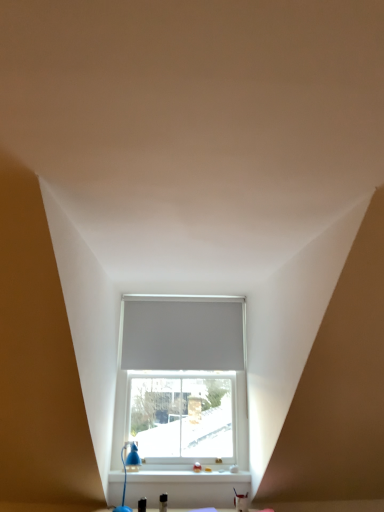
What do you see at coordinates (182, 335) in the screenshot? I see `white matte blind at center` at bounding box center [182, 335].

What do you see at coordinates (188, 477) in the screenshot?
I see `white plastic window sill at lower center` at bounding box center [188, 477].

The image size is (384, 512). I want to click on white plastic window sill at lower center, so pos(188,477).

Where is `blue plastic table lamp at lower left`? The height and width of the screenshot is (512, 384). blue plastic table lamp at lower left is located at coordinates (126, 470).

Find the location of a particular element. This screenshot has height=512, width=384. white matte window at center is located at coordinates (174, 364).

At what (x,y) coordinates should I click in order to perform the action: click on white matte blind at center. Please return your answer as a coordinate pair (x, y). This screenshot has width=384, height=512. Looking at the image, I should click on (182, 335).

From a real-world perspective, between white matte blind at center and white matte window at center, who is vertically lower?

white matte window at center, from a real-world perspective.

Between white matte blind at center and white matte window at center, which one has more height?

white matte window at center.

What's the angular difference between white matte blind at center and white matte window at center's facing directions?

The angular difference between white matte blind at center and white matte window at center is 0.00343 degrees.

Does white matte blind at center appear on the right side of white matte window at center?

Yes, white matte blind at center is to the right of white matte window at center.

From the picture: How different are the orientations of blue plastic table lamp at lower left and white plastic window sill at lower center in degrees?

blue plastic table lamp at lower left and white plastic window sill at lower center are facing 0.00545 degrees away from each other.

Is point (129, 465) closer to viewer compared to point (161, 482)?

No, it is behind (161, 482).

Locate an element on the screen. table lamp above the white plastic window sill at lower center (from a real-world perspective) is located at coordinates (126, 470).

Considering the sizes of objects blue plastic table lamp at lower left and white plastic window sill at lower center in the image provided, who is smaller, blue plastic table lamp at lower left or white plastic window sill at lower center?

Smaller between the two is blue plastic table lamp at lower left.

Is white plastic window sill at lower center inside or outside of white matte blind at center?

white plastic window sill at lower center is spatially situated outside white matte blind at center.

You are a GUI agent. You are given a task and a screenshot of the screen. Output one action in this format:
    pyautogui.click(x=<x>, y=<y>)
    Task: Click on the window sill in front of the white matte blind at center
    This screenshot has height=512, width=384.
    Given the screenshot: What is the action you would take?
    pyautogui.click(x=188, y=477)

From a real-world perspective, who is located higher, white plastic window sill at lower center or white matte blind at center?

In real-world perspective, white matte blind at center is above.

Consider the image. Considering the relative sizes of white plastic window sill at lower center and white matte blind at center in the image provided, is white plastic window sill at lower center bigger than white matte blind at center?

No, white plastic window sill at lower center is not bigger than white matte blind at center.

Is blue plastic table lamp at lower left bigger or smaller than white matte blind at center?

Clearly, blue plastic table lamp at lower left is smaller in size than white matte blind at center.

From the image's perspective, is blue plastic table lamp at lower left above white matte blind at center?

No.

Would you say white matte blind at center is part of blue plastic table lamp at lower left's contents?

No, white matte blind at center is not inside blue plastic table lamp at lower left.

Considering the points (122, 456) and (203, 343), which point is in front, point (122, 456) or point (203, 343)?

Point (122, 456)

Does white matte blind at center have a greater height compared to white plastic window sill at lower center?

Correct, white matte blind at center is much taller as white plastic window sill at lower center.

Where is `window sill directly beneath the white matte blind at center (from a real-world perspective)`? The width and height of the screenshot is (384, 512). window sill directly beneath the white matte blind at center (from a real-world perspective) is located at coordinates (188, 477).

Which is behind, white matte blind at center or white plastic window sill at lower center?

white matte blind at center is further away from the camera.

Which is nearer, (219, 316) or (216, 471)?

Positioned in front is point (216, 471).

Between white matte blind at center and blue plastic table lamp at lower left, which one has more height?

Standing taller between the two is white matte blind at center.

Is white matte blind at center oriented towards blue plastic table lamp at lower left?

No, white matte blind at center is not facing towards blue plastic table lamp at lower left.

From the picture: In the image, is white matte blind at center positioned in front of or behind blue plastic table lamp at lower left?

Clearly, white matte blind at center is behind blue plastic table lamp at lower left.

Is white matte blind at center positioned far away from blue plastic table lamp at lower left?

white matte blind at center is near blue plastic table lamp at lower left, not far away.

Is white matte window at center positioned in front of white plastic window sill at lower center?

No, the depth of white matte window at center is greater than that of white plastic window sill at lower center.

From the image's perspective, between white matte window at center and white plastic window sill at lower center, which one is located above?

white matte window at center is shown above in the image.

This screenshot has width=384, height=512. I want to click on window sill that is under the white matte window at center (from a real-world perspective), so click(188, 477).

Where is `blind above the white matte window at center (from the image's perspective)`? This screenshot has width=384, height=512. blind above the white matte window at center (from the image's perspective) is located at coordinates (182, 335).

Identify the location of window sill behind the blue plastic table lamp at lower left. The height and width of the screenshot is (512, 384). (188, 477).

Estimate the real-world distances between objects in this image. Which object is further from white matte window at center, white matte blind at center or white plastic window sill at lower center?

Based on the image, white plastic window sill at lower center appears to be further to white matte window at center.

From the image, which object appears to be nearer to white matte window at center, blue plastic table lamp at lower left or white plastic window sill at lower center?

white plastic window sill at lower center.

Estimate the real-world distances between objects in this image. Which object is closer to blue plastic table lamp at lower left, white plastic window sill at lower center or white matte blind at center?

Based on the image, white plastic window sill at lower center appears to be nearer to blue plastic table lamp at lower left.

Considering their positions, is white matte blind at center positioned closer to white plastic window sill at lower center than blue plastic table lamp at lower left?

Among the two, blue plastic table lamp at lower left is located nearer to white plastic window sill at lower center.

Looking at the image, which one is located closer to blue plastic table lamp at lower left, white matte window at center or white matte blind at center?

The object closer to blue plastic table lamp at lower left is white matte window at center.

Estimate the real-world distances between objects in this image. Which object is closer to white plastic window sill at lower center, blue plastic table lamp at lower left or white matte blind at center?

Among the two, blue plastic table lamp at lower left is located nearer to white plastic window sill at lower center.

Estimate the real-world distances between objects in this image. Which object is closer to white matte window at center, white plastic window sill at lower center or white matte blind at center?

white matte blind at center is closer to white matte window at center.

Consider the image. Which object lies nearer to the anchor point blue plastic table lamp at lower left, white matte window at center or white plastic window sill at lower center?

The object closer to blue plastic table lamp at lower left is white plastic window sill at lower center.

The height and width of the screenshot is (512, 384). I want to click on window between white matte blind at center and white plastic window sill at lower center vertically, so click(174, 364).

Identify the location of table lamp between white matte blind at center and white plastic window sill at lower center in the up-down direction. (126, 470).

Locate an element on the screen. The width and height of the screenshot is (384, 512). window that lies between white matte blind at center and blue plastic table lamp at lower left from top to bottom is located at coordinates (174, 364).

Find the location of `table lamp between white matte window at center and white plastic window sill at lower center from top to bottom`. table lamp between white matte window at center and white plastic window sill at lower center from top to bottom is located at coordinates (126, 470).